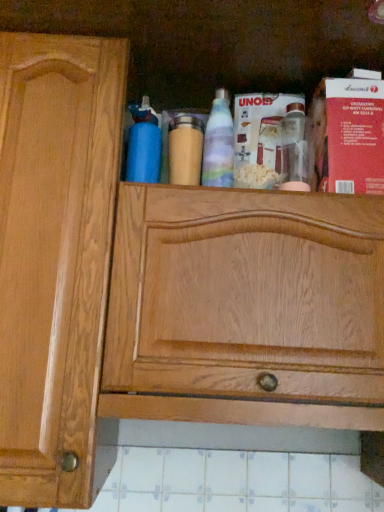
Question: Would you say blue matte bottle at upper center, the 1th bottle in the left-to-right sequence, is inside or outside wooden bottle at center, acting as the second bottle starting from the right?

Choices:
 (A) inside
 (B) outside

Answer: (B)

Question: From a real-world perspective, is blue matte bottle at upper center, the 1th bottle in the left-to-right sequence, positioned above or below wooden bottle at center, which ranks as the second bottle in left-to-right order?

Choices:
 (A) above
 (B) below

Answer: (A)

Question: Which object is positioned farthest from the blue matte bottle at upper center, the third bottle viewed from the right?

Choices:
 (A) translucent plastic bottle at center, the first bottle viewed from the right
 (B) wooden bottle at center, acting as the second bottle starting from the right

Answer: (A)

Question: Estimate the real-world distances between objects in this image. Which object is farther from the translucent plastic bottle at center, positioned as the third bottle in left-to-right order?

Choices:
 (A) wooden bottle at center, which ranks as the second bottle in left-to-right order
 (B) blue matte bottle at upper center, the 1th bottle in the left-to-right sequence

Answer: (B)